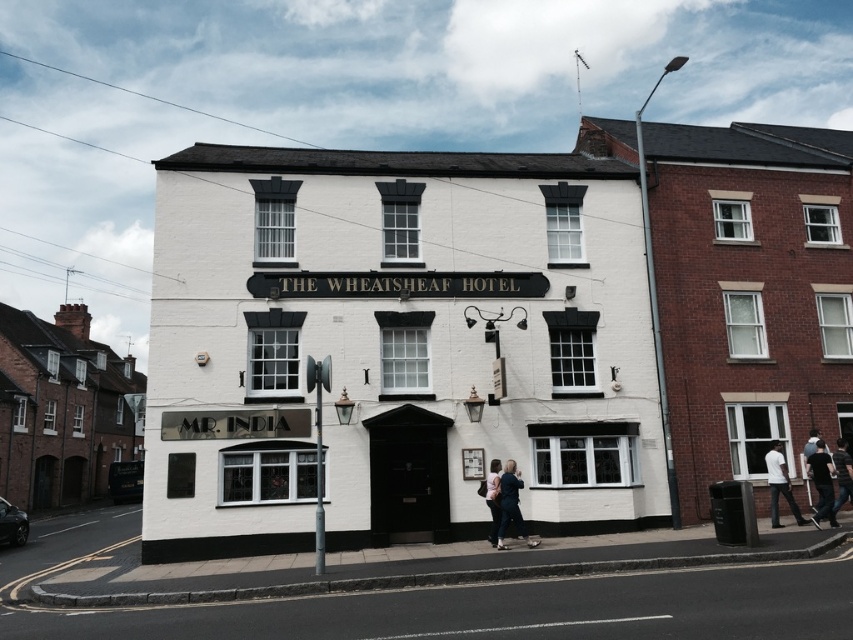
Does dark blue dress at lower center lie behind white cotton shirt at lower right?

No, dark blue dress at lower center is closer to the viewer.

Between dark blue dress at lower center and white cotton shirt at lower right, which one is positioned lower?

dark blue dress at lower center is lower down.

Is point (497, 532) behind point (775, 460)?

That is False.

Find the location of a particular element. The width and height of the screenshot is (853, 640). dark blue dress at lower center is located at coordinates (511, 506).

Can you confirm if black cotton shirt at lower right is positioned to the right of white cotton shirt at lower right?

Indeed, black cotton shirt at lower right is positioned on the right side of white cotton shirt at lower right.

Is black cotton shirt at lower right shorter than white cotton shirt at lower right?

In fact, black cotton shirt at lower right may be taller than white cotton shirt at lower right.

What do you see at coordinates (822, 483) in the screenshot? The image size is (853, 640). I see `black cotton shirt at lower right` at bounding box center [822, 483].

The height and width of the screenshot is (640, 853). What are the coordinates of `black cotton shirt at lower right` in the screenshot? It's located at (822, 483).

Based on the photo, does dark blue dress at lower center have a smaller size compared to light brown leather jacket at lower center?

No.

Is dark blue dress at lower center wider than light brown leather jacket at lower center?

Yes.

You are a GUI agent. You are given a task and a screenshot of the screen. Output one action in this format:
    pyautogui.click(x=<x>, y=<y>)
    Task: Click on the dark blue dress at lower center
    This screenshot has height=640, width=853.
    Given the screenshot: What is the action you would take?
    pyautogui.click(x=511, y=506)